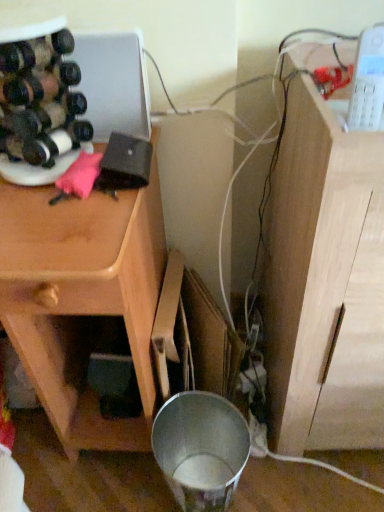
Question: Considering the relative positions of light wood cabinet at right and wooden cabinet at left in the image provided, is light wood cabinet at right in front of wooden cabinet at left?

Choices:
 (A) yes
 (B) no

Answer: (A)

Question: Is light wood cabinet at right thinner than wooden cabinet at left?

Choices:
 (A) yes
 (B) no

Answer: (B)

Question: Can you confirm if light wood cabinet at right is positioned to the left of wooden cabinet at left?

Choices:
 (A) yes
 (B) no

Answer: (B)

Question: Can you confirm if light wood cabinet at right is shorter than wooden cabinet at left?

Choices:
 (A) no
 (B) yes

Answer: (A)

Question: Could you tell me if light wood cabinet at right is facing wooden cabinet at left?

Choices:
 (A) no
 (B) yes

Answer: (A)

Question: Is light wood cabinet at right at the right side of wooden cabinet at left?

Choices:
 (A) yes
 (B) no

Answer: (A)

Question: From the image's perspective, is matte black wine bottle at left, positioned as the 1th wine bottle in bottom-to-top order, below wooden cabinet at left?

Choices:
 (A) no
 (B) yes

Answer: (A)

Question: Does matte black wine bottle at left, positioned as the 1th wine bottle in bottom-to-top order, lie behind wooden cabinet at left?

Choices:
 (A) yes
 (B) no

Answer: (A)

Question: Can you confirm if matte black wine bottle at left, the second wine bottle when ordered from top to bottom, is taller than wooden cabinet at left?

Choices:
 (A) yes
 (B) no

Answer: (B)

Question: From the image's perspective, is matte black wine bottle at left, positioned as the 1th wine bottle in bottom-to-top order, located above wooden cabinet at left?

Choices:
 (A) no
 (B) yes

Answer: (B)

Question: Can you confirm if matte black wine bottle at left, positioned as the 1th wine bottle in bottom-to-top order, is smaller than wooden cabinet at left?

Choices:
 (A) yes
 (B) no

Answer: (A)

Question: From a real-world perspective, is matte black wine bottle at left, the 2th wine bottle in the bottom-to-top sequence, beneath light wood cabinet at right?

Choices:
 (A) no
 (B) yes

Answer: (A)